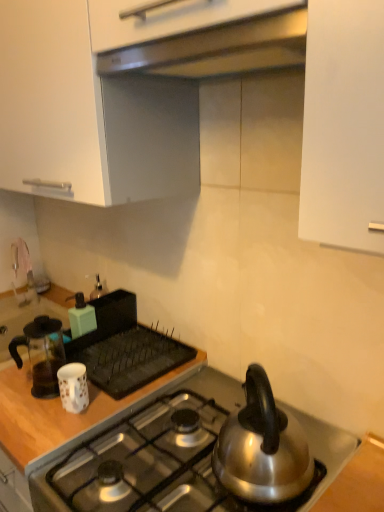
The height and width of the screenshot is (512, 384). What are the coordinates of `empty space that is to the right of transparent glass coffee pot at left, arranged as the second kitchen appliance when viewed from the back` in the screenshot? It's located at (113, 372).